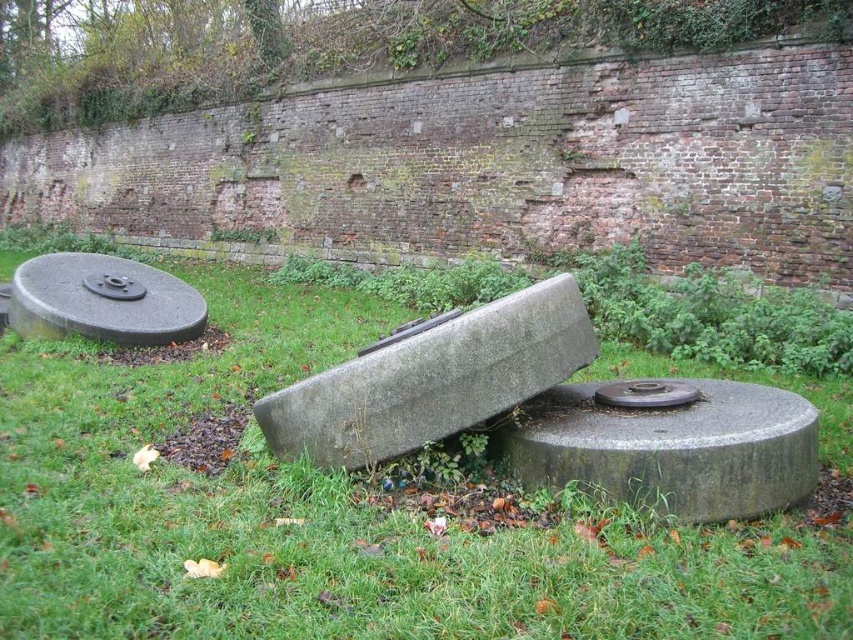
Question: Can you confirm if gray concrete at center is wider than smooth gray concrete at left?

Choices:
 (A) no
 (B) yes

Answer: (A)

Question: From the image, what is the correct spatial relationship of gray concrete cement at center in relation to gray concrete at center?

Choices:
 (A) right
 (B) left

Answer: (B)

Question: Which point is closer to the camera?

Choices:
 (A) green grass at center
 (B) smooth gray concrete at left
 (C) gray concrete cement at center
 (D) gray concrete at center

Answer: (A)

Question: In this image, where is green grass at center located relative to smooth gray concrete at left?

Choices:
 (A) left
 (B) right

Answer: (B)

Question: Which object is farther from the camera taking this photo?

Choices:
 (A) gray concrete cement at center
 (B) green grass at center
 (C) gray concrete at center

Answer: (A)

Question: Among these objects, which one is farthest from the camera?

Choices:
 (A) gray concrete cement at center
 (B) smooth gray concrete at left

Answer: (B)